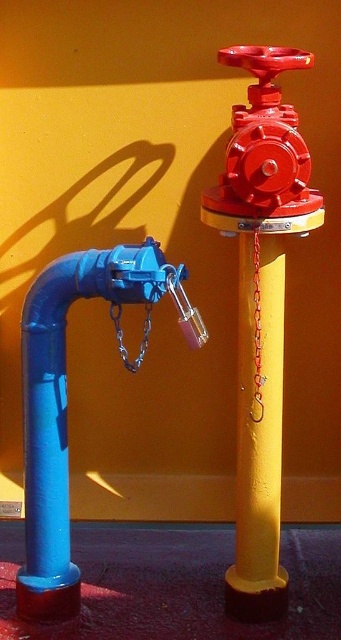
Question: Among these objects, which one is farthest from the camera?

Choices:
 (A) blue matte water pipe at left
 (B) yellow matte/yellowish-golden pole at center-right

Answer: (A)

Question: Is blue matte water pipe at left positioned in front of shiny red valve at upper right?

Choices:
 (A) yes
 (B) no

Answer: (B)

Question: Is blue matte water pipe at left positioned behind shiny red valve at upper right?

Choices:
 (A) no
 (B) yes

Answer: (B)

Question: Which object is the closest to the yellow matte/yellowish-golden pole at center-right?

Choices:
 (A) shiny red valve at upper right
 (B) blue matte water pipe at left

Answer: (A)

Question: Based on their relative distances, which object is farther from the yellow matte/yellowish-golden pole at center-right?

Choices:
 (A) blue matte water pipe at left
 (B) shiny red valve at upper right

Answer: (A)

Question: Can you confirm if blue matte water pipe at left is positioned to the left of yellow matte/yellowish-golden pole at center-right?

Choices:
 (A) no
 (B) yes

Answer: (B)